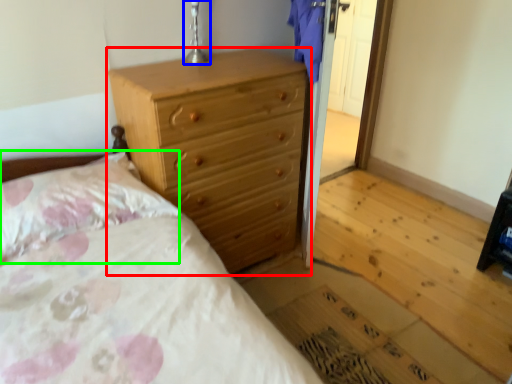
Question: Which is nearer to the chest of drawers (highlighted by a red box)? table lamp (highlighted by a blue box) or pillow (highlighted by a green box).

Choices:
 (A) table lamp
 (B) pillow

Answer: (B)